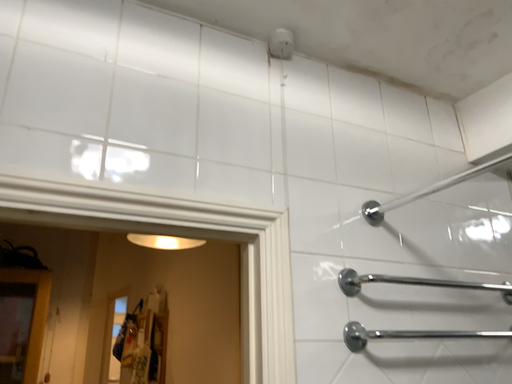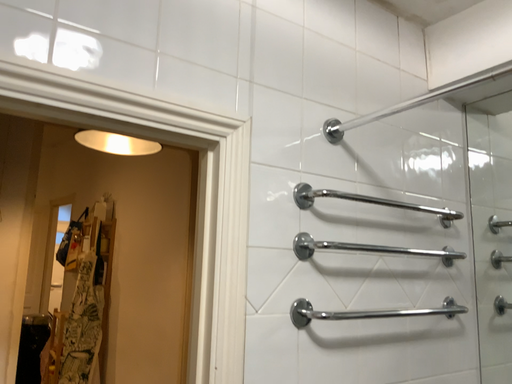
Question: Which way did the camera rotate in the video?

Choices:
 (A) rotated right
 (B) rotated left

Answer: (A)